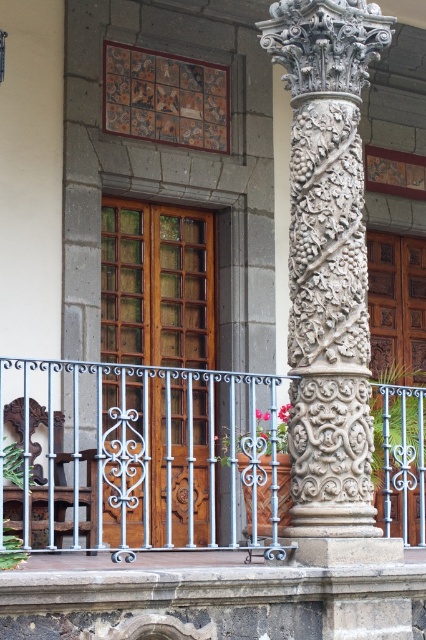
You are an architect examining the building facade. You notice the white wrought iron balustrade at center and the white stone column at center. Which object is closer to you as you stand in front of the building?

The white wrought iron balustrade at center is closer because it is in front of the white stone column at center.

You are an architect designing a new building facade and want to ensure proper clearance for a delivery truck that is 2.5 meters tall. Given the scene described, which object between the white wrought iron balustrade at center and the white stone column at center would pose a height obstruction for the truck?

The white wrought iron balustrade at center has a greater height compared to the white stone column at center. Since the balustrade is taller, it would pose a height obstruction for the delivery truck if its height exceeds 2.5 meters.